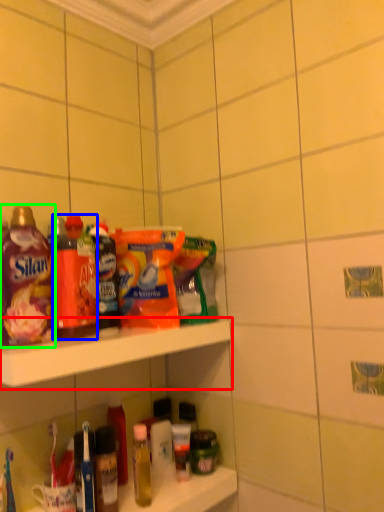
Question: Estimate the real-world distances between objects in this image. Which object is farther from shelf (highlighted by a red box), bottle (highlighted by a blue box) or bottle (highlighted by a green box)?

Choices:
 (A) bottle
 (B) bottle

Answer: (B)